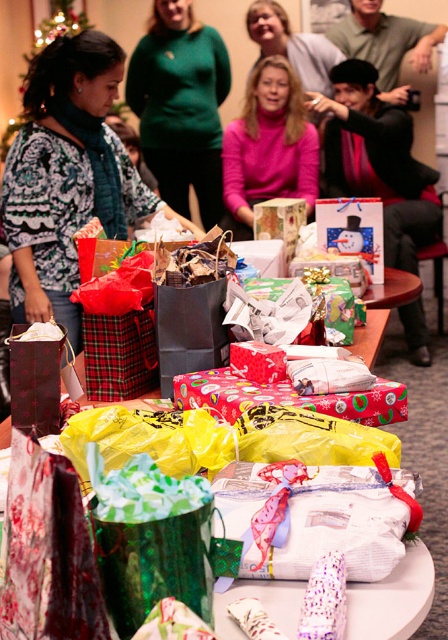
You are standing at the table during the gift exchange. There are two points on the table where gifts might be placed. One is at coordinates point (x=348, y=84) and the other at point (x=242, y=156). If you want to place a gift closer to the people gathered around the table, which coordinate should you choose?

Point (x=242, y=156) is closer to the people gathered around the table because point (x=348, y=84) is behind it.

You are at a holiday party and want to grab a gift from the table. You see the matte black jacket at upper right and the pink matte sweater at center. Which person is closer to you so you can ask them for help?

The matte black jacket at upper right is closer to the viewer than the pink matte sweater at center, so you should ask the person wearing the matte black jacket at upper right for help.